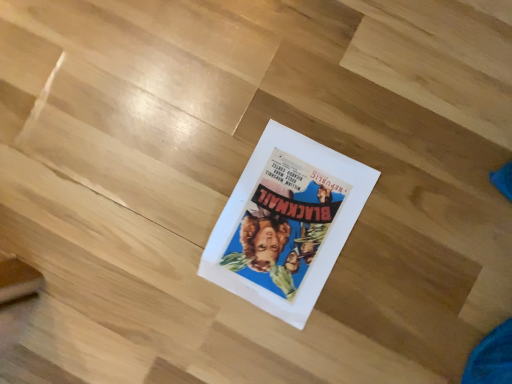
Find the location of a particular element. Image resolution: width=512 pixels, height=384 pixels. free point to the right of white paper poster at center is located at coordinates (395, 142).